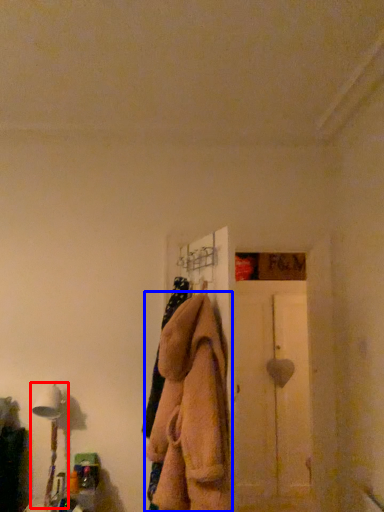
Question: Among these objects, which one is farthest to the camera, table lamp (highlighted by a red box) or clothing (highlighted by a blue box)?

Choices:
 (A) table lamp
 (B) clothing

Answer: (A)